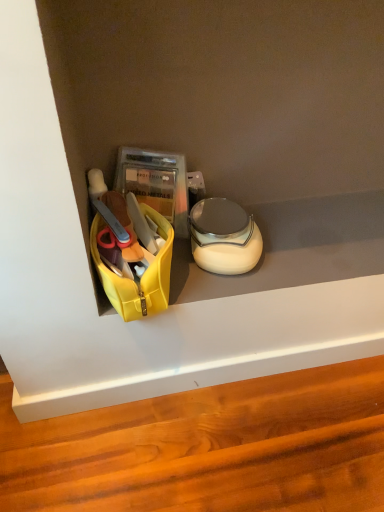
Find the location of a particular element. The height and width of the screenshot is (512, 384). white glossy jar at center is located at coordinates (224, 237).

The width and height of the screenshot is (384, 512). What do you see at coordinates (224, 237) in the screenshot?
I see `white glossy jar at center` at bounding box center [224, 237].

What is the approximate width of white glossy jar at center?

The width of white glossy jar at center is 8.00 inches.

At what (x,y) coordinates should I click in order to perform the action: click on white glossy jar at center. Please return your answer as a coordinate pair (x, y). The width and height of the screenshot is (384, 512). Looking at the image, I should click on [x=224, y=237].